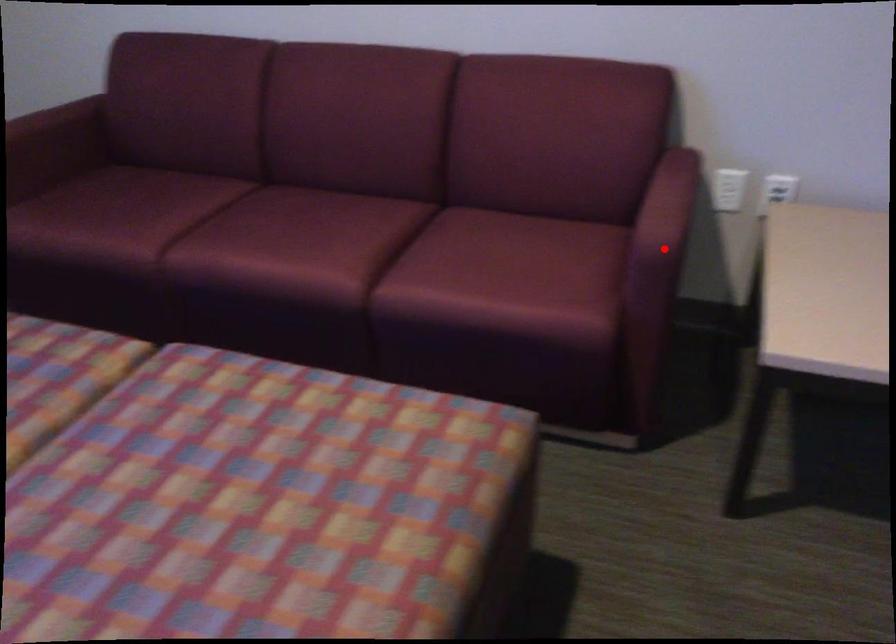
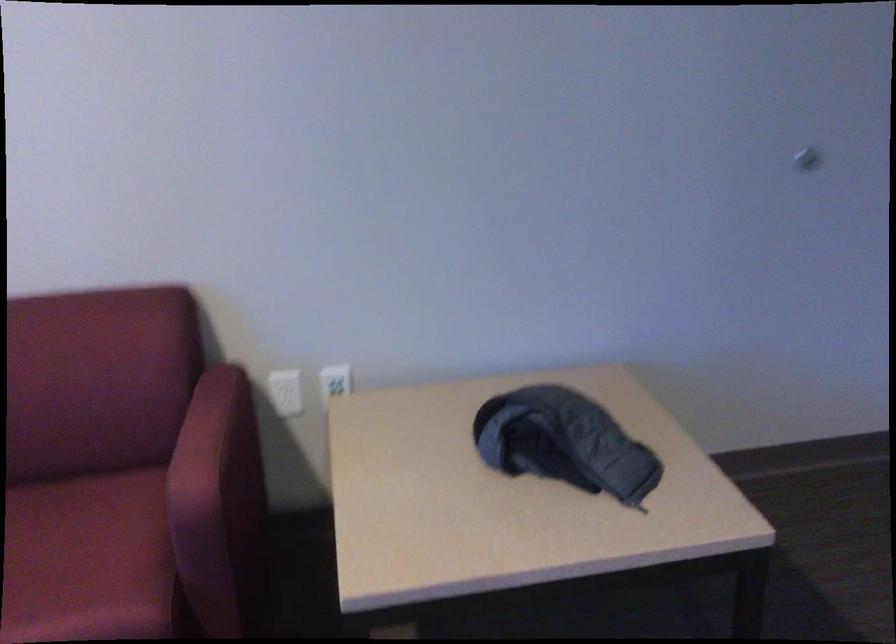
Find the pixel in the second image that matches the highlighted location in the first image.

(204, 504)